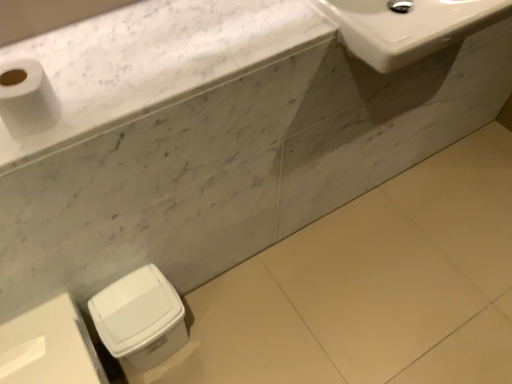
Question: From the image's perspective, is white plastic trash can at lower left, marked as the 1th porcelain in a right-to-left arrangement, under white matte toilet paper at upper left?

Choices:
 (A) no
 (B) yes

Answer: (B)

Question: From a real-world perspective, is white plastic trash can at lower left, marked as the second porcelain in a left-to-right arrangement, positioned under white matte toilet paper at upper left based on gravity?

Choices:
 (A) yes
 (B) no

Answer: (A)

Question: Is white plastic trash can at lower left, marked as the second porcelain in a left-to-right arrangement, with white matte toilet paper at upper left?

Choices:
 (A) no
 (B) yes

Answer: (A)

Question: Can you confirm if white plastic trash can at lower left, marked as the second porcelain in a left-to-right arrangement, is wider than white matte toilet paper at upper left?

Choices:
 (A) yes
 (B) no

Answer: (A)

Question: Does white plastic trash can at lower left, marked as the second porcelain in a left-to-right arrangement, have a smaller size compared to white matte toilet paper at upper left?

Choices:
 (A) no
 (B) yes

Answer: (A)

Question: Considering the positions of point (146, 69) and point (164, 311), is point (146, 69) closer or farther from the camera than point (164, 311)?

Choices:
 (A) farther
 (B) closer

Answer: (B)

Question: From their relative heights in the image, would you say white marble countertop at upper left is taller or shorter than white plastic trash can at lower left, marked as the 1th porcelain in a right-to-left arrangement?

Choices:
 (A) short
 (B) tall

Answer: (A)

Question: In terms of size, does white marble countertop at upper left appear bigger or smaller than white plastic trash can at lower left, marked as the 1th porcelain in a right-to-left arrangement?

Choices:
 (A) small
 (B) big

Answer: (A)

Question: Considering the positions of white marble countertop at upper left and white plastic trash can at lower left, marked as the second porcelain in a left-to-right arrangement, in the image, is white marble countertop at upper left wider or thinner than white plastic trash can at lower left, marked as the second porcelain in a left-to-right arrangement,?

Choices:
 (A) thin
 (B) wide

Answer: (B)

Question: Is white glossy sink at upper right spatially inside white matte toilet paper at upper left, or outside of it?

Choices:
 (A) inside
 (B) outside

Answer: (B)

Question: From the image's perspective, relative to white matte toilet paper at upper left, is white glossy sink at upper right above or below?

Choices:
 (A) below
 (B) above

Answer: (B)

Question: Relative to white matte toilet paper at upper left, is white glossy sink at upper right in front or behind?

Choices:
 (A) behind
 (B) front

Answer: (A)

Question: Is point (397, 21) positioned closer to the camera than point (51, 114)?

Choices:
 (A) closer
 (B) farther

Answer: (B)

Question: Relative to white marble countertop at upper left, is white plastic trash can at lower left, the 2th porcelain from the right, in front or behind?

Choices:
 (A) behind
 (B) front

Answer: (A)

Question: Based on their sizes in the image, would you say white plastic trash can at lower left, the first porcelain viewed from the left, is bigger or smaller than white marble countertop at upper left?

Choices:
 (A) big
 (B) small

Answer: (A)